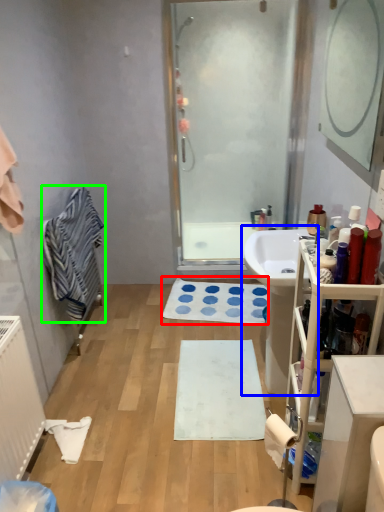
Question: Considering the real-world distances, which object is closest to bath mat (highlighted by a red box)? sink (highlighted by a blue box) or bath towel (highlighted by a green box).

Choices:
 (A) sink
 (B) bath towel

Answer: (A)